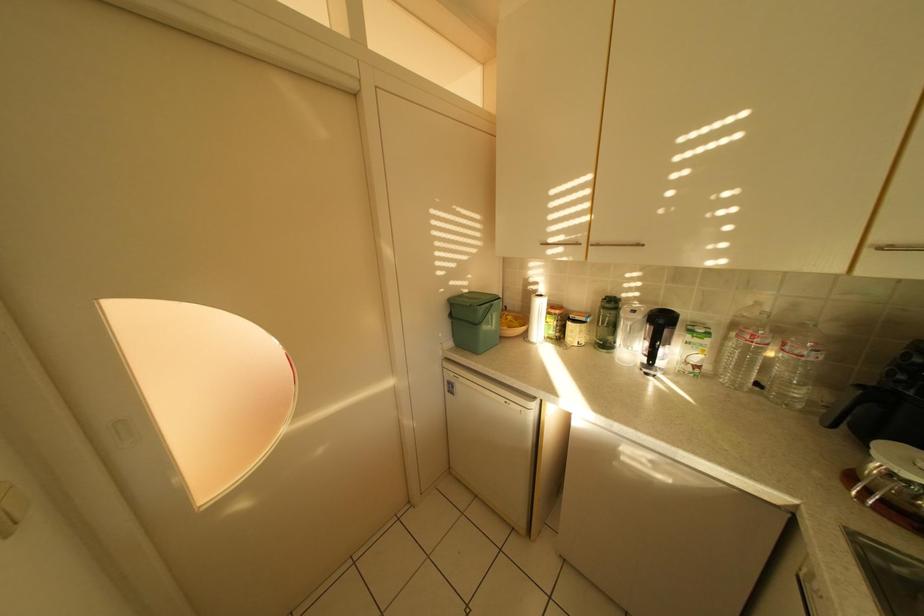
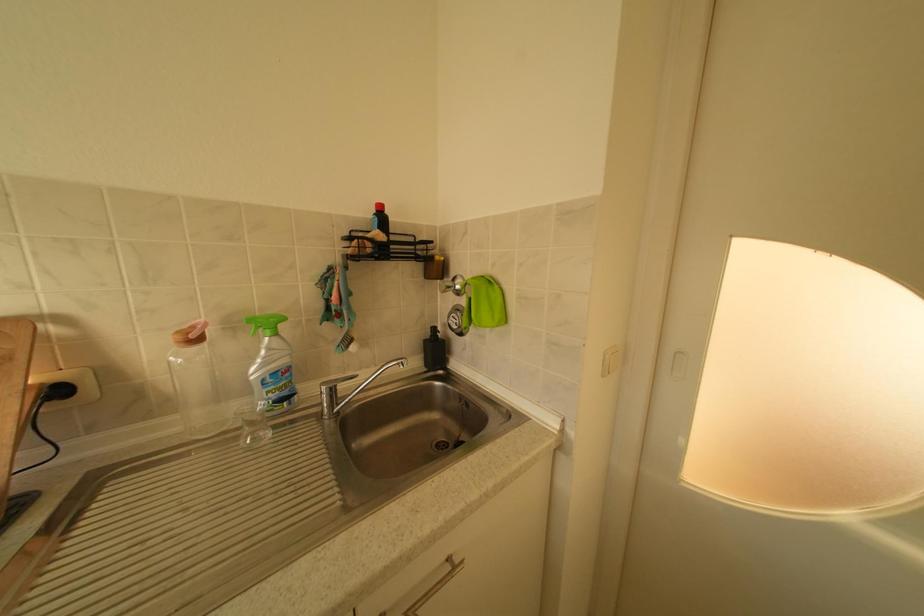
Question: The camera is either moving clockwise (left) or counter-clockwise (right) around the object. The first image is from the beginning of the video and the second image is from the end. Is the camera moving left or right when shooting the video?

Choices:
 (A) Left
 (B) Right

Answer: (B)